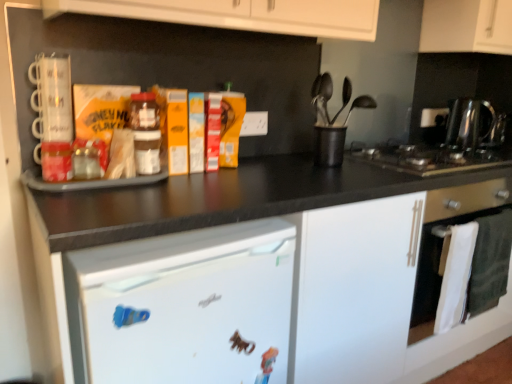
Image resolution: width=512 pixels, height=384 pixels. I want to click on vacant space positioned to the left of polished stainless steel kettle at right, so [415, 150].